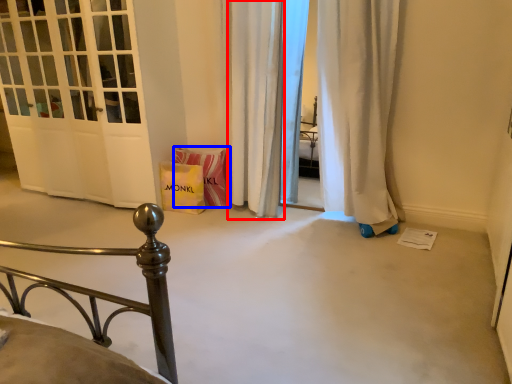
Question: Among these objects, which one is nearest to the camera, curtain (highlighted by a red box) or material (highlighted by a blue box)?

Choices:
 (A) curtain
 (B) material

Answer: (A)